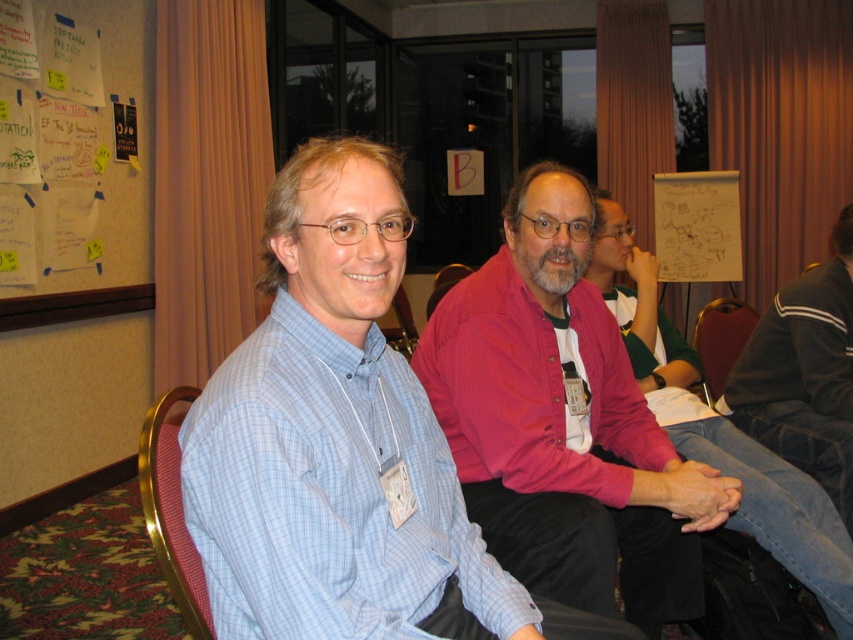
You are a photographer who needs to capture a clear shot of both the matte red shirt at center and the white paper at upper center. Based on their positions, which object should you focus on first to ensure both are in frame?

The white paper at upper center should be focused on first since the matte red shirt at center is positioned under it, ensuring both will be in frame when starting from the top.

You are a photographer trying to capture a clear shot of both the matte red shirt at center and the white paper at upper center. Based on their sizes, which object should you focus on first to ensure it fits in the frame?

The matte red shirt at center might be wider than the white paper at upper center, so you should focus on the matte red shirt at center first to ensure it fits in the frame since it could be wider.